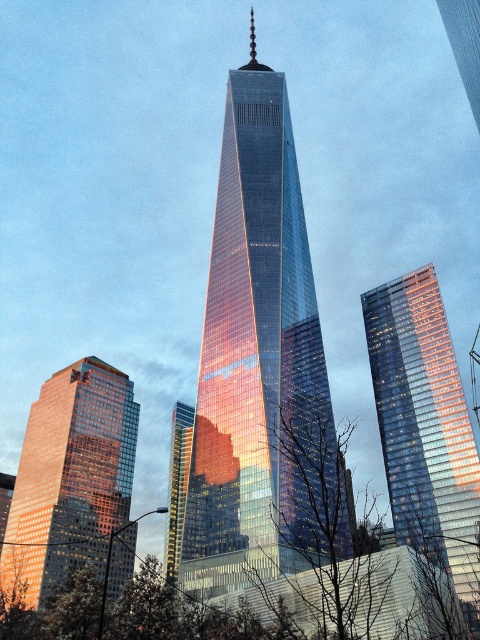
Question: Based on their relative distances, which object is nearer to the glassy reflective skyscraper at right?

Choices:
 (A) shiny glass skyscraper at center
 (B) gold reflective glass skyscraper at center

Answer: (A)

Question: Does shiny glass skyscraper at lower left have a greater width compared to gold reflective glass skyscraper at center?

Choices:
 (A) no
 (B) yes

Answer: (B)

Question: Is shiny glass skyscraper at center bigger than gold reflective glass skyscraper at center?

Choices:
 (A) yes
 (B) no

Answer: (A)

Question: Which point is farther to the camera?

Choices:
 (A) glassy reflective skyscraper at right
 (B) shiny glass skyscraper at lower left
 (C) gold reflective glass skyscraper at center

Answer: (C)

Question: Does shiny glass skyscraper at center appear on the left side of shiny glass skyscraper at lower left?

Choices:
 (A) no
 (B) yes

Answer: (A)

Question: Which of the following is the farthest from the observer?

Choices:
 (A) gold reflective glass skyscraper at center
 (B) glassy reflective skyscraper at right
 (C) shiny glass skyscraper at center
 (D) shiny glass skyscraper at lower left

Answer: (A)